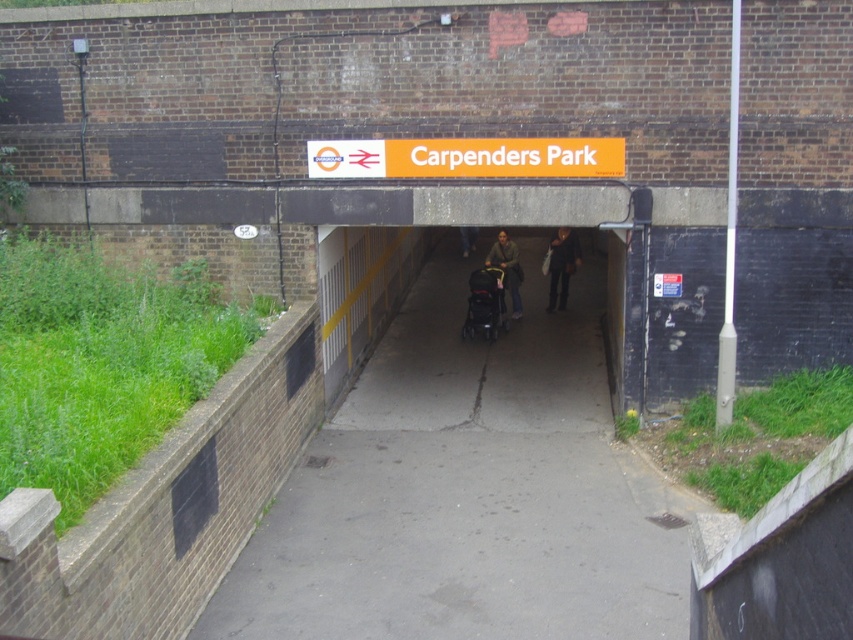
You are a parent carrying a toddler and need to push your black plastic baby carriage at center through the tunnel entrance. Given the tunnel entrance has a width of 2 meters, and your carriage is 1.2 meters wide, will it fit through the entrance?

The black plastic baby carriage at center is positioned at point (485, 304), which is within the tunnel entrance width of 2 meters. Since the carriage is only 1.2 meters wide, it will fit through the entrance easily.

You are a pedestrian standing at the entrance of the tunnel. You see the concrete sidewalk at center and the dark gray fabric jacket at center. Which object is closer to you?

The concrete sidewalk at center is closer to the viewer than the dark gray fabric jacket at center.

You are a parent carrying a dark gray fabric jacket at center and pushing a black plastic baby carriage at center through the tunnel. Can you walk upright without bending? Explain why based on the objects in the scene.

The black plastic baby carriage at center has a lesser height compared to dark gray fabric jacket at center. Since the jacket is taller than the carriage, the parent can likely walk upright without bending, as the jacket is not blocking the height clearance. However, the tunnel has a damp floor with a central crack, so caution is advised for stability.